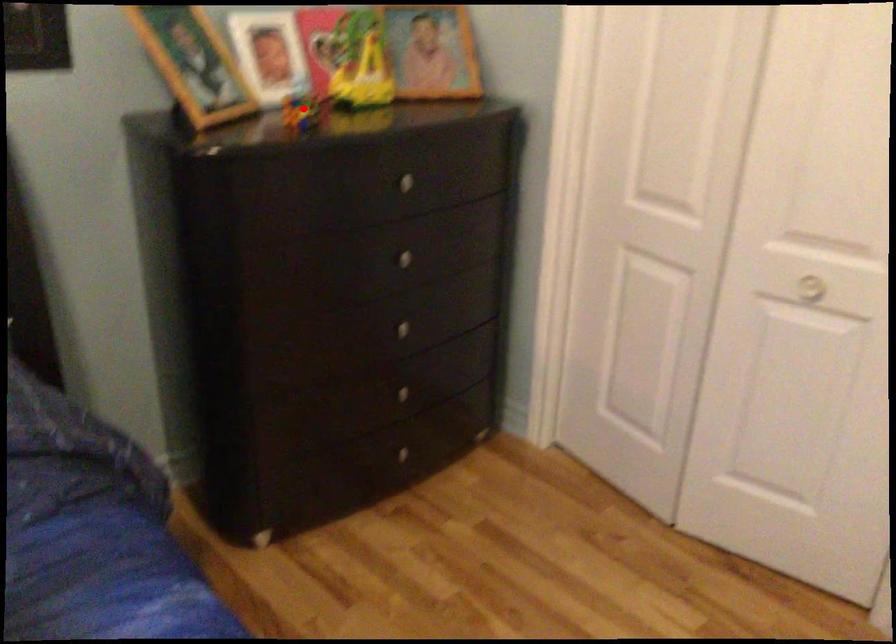
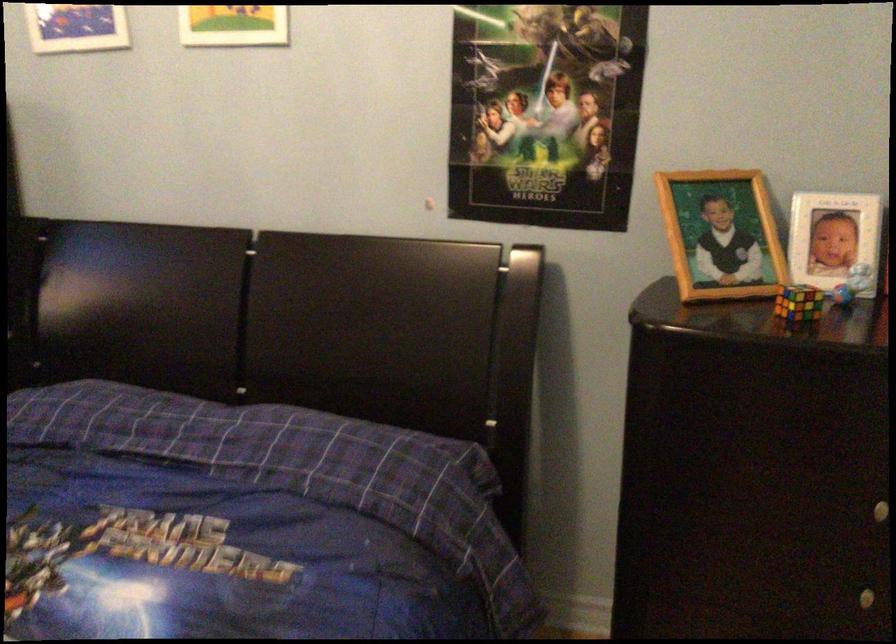
Question: I am providing you with two images of the same scene from different viewpoints. Image1 has a red point marked. In image2, the corresponding 3D location appears at what relative position? Reply with the corresponding letter.

Choices:
 (A) Closer
 (B) Farther

Answer: (A)